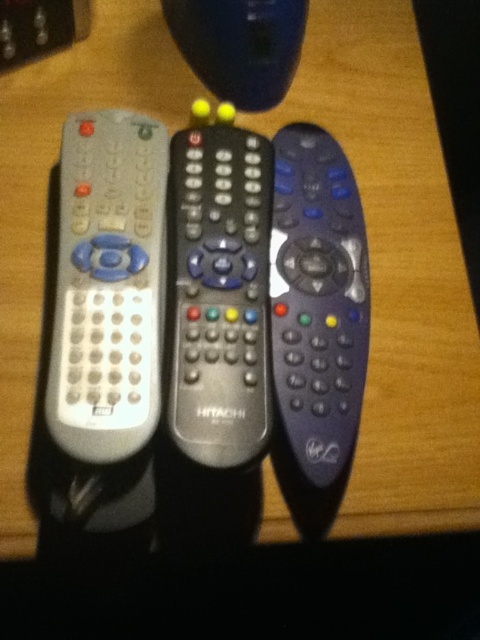
Question: Considering the relative positions of white matte remote at left and matte black remote at center in the image provided, where is white matte remote at left located with respect to matte black remote at center?

Choices:
 (A) right
 (B) left

Answer: (B)

Question: Which object is positioned farthest from the metallic gray remote at center?

Choices:
 (A) white matte remote at left
 (B) matte black remote at center

Answer: (B)

Question: Can you confirm if white matte remote at left is positioned above metallic gray remote at center?

Choices:
 (A) no
 (B) yes

Answer: (B)

Question: Among these points, which one is nearest to the camera?

Choices:
 (A) coord(168,141)
 (B) coord(187,337)

Answer: (B)

Question: Which object appears closest to the camera in this image?

Choices:
 (A) metallic gray remote at center
 (B) white matte remote at left

Answer: (B)

Question: Can you confirm if white matte remote at left is positioned to the right of matte black remote at center?

Choices:
 (A) no
 (B) yes

Answer: (A)